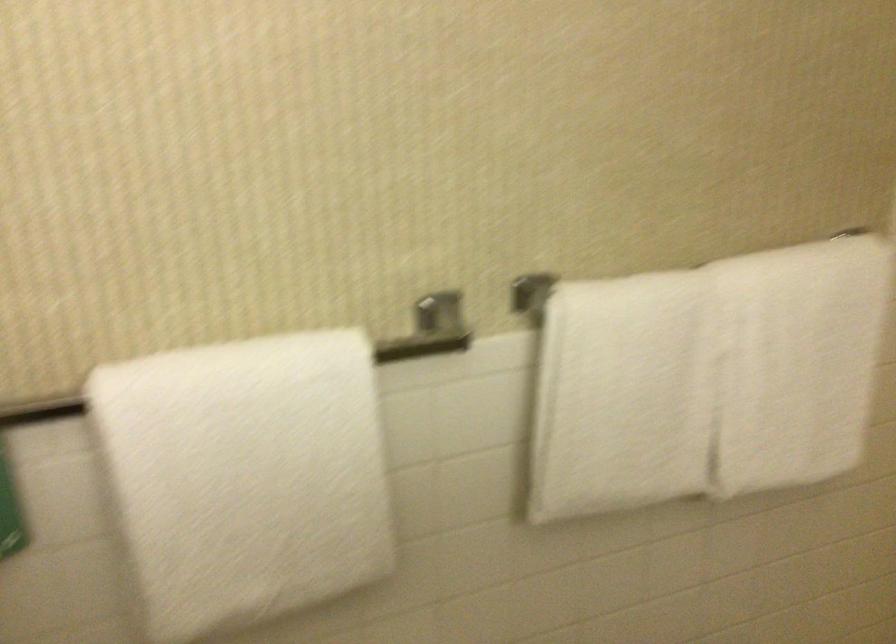
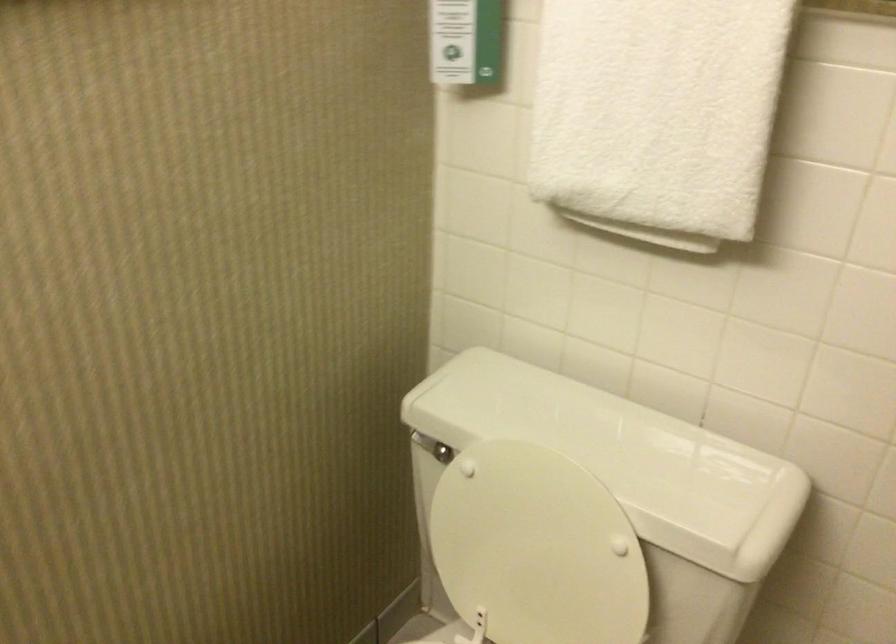
Find the pixel in the second image that matches point (271, 509) in the first image.

(657, 114)